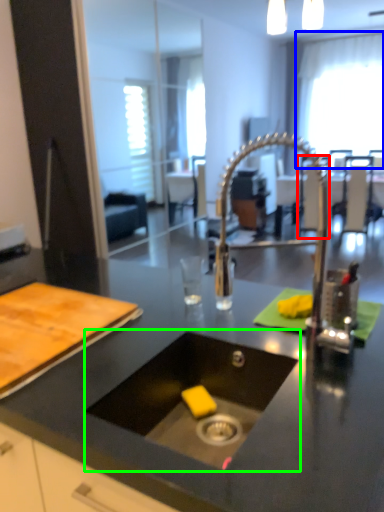
Question: Based on their relative distances, which object is nearer to chair (highlighted by a red box)? Choose from window screen (highlighted by a blue box) and sink (highlighted by a green box).

Choices:
 (A) window screen
 (B) sink

Answer: (B)